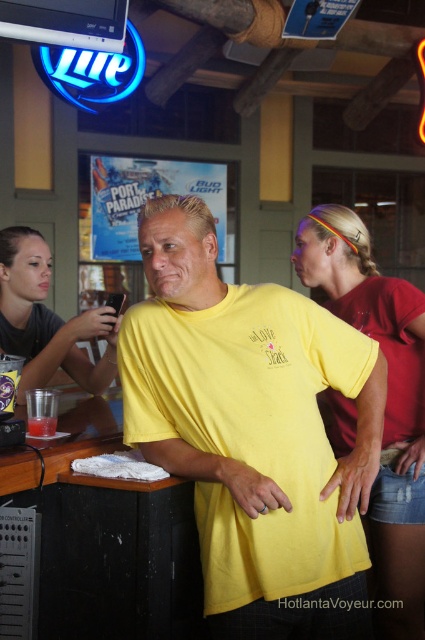
Question: Which object is closer to the camera taking this photo?

Choices:
 (A) clear plastic cup at bar left
 (B) matte gray shirt at center

Answer: (A)

Question: Is denim shorts at center bigger than matte gray shirt at center?

Choices:
 (A) no
 (B) yes

Answer: (B)

Question: Which point is farther to the camera?

Choices:
 (A) matte gray shirt at center
 (B) yellow cotton t-shirt at center
 (C) clear plastic cup at bar left
 (D) denim shorts at center

Answer: (A)

Question: Which object is the farthest from the yellow cotton t-shirt at center?

Choices:
 (A) denim shorts at center
 (B) matte gray shirt at center
 (C) clear plastic cup at bar left

Answer: (B)

Question: Is yellow cotton t-shirt at center above clear plastic cup at bar left?

Choices:
 (A) yes
 (B) no

Answer: (A)

Question: Considering the relative positions of yellow cotton t-shirt at center and matte gray shirt at center in the image provided, where is yellow cotton t-shirt at center located with respect to matte gray shirt at center?

Choices:
 (A) left
 (B) right

Answer: (B)